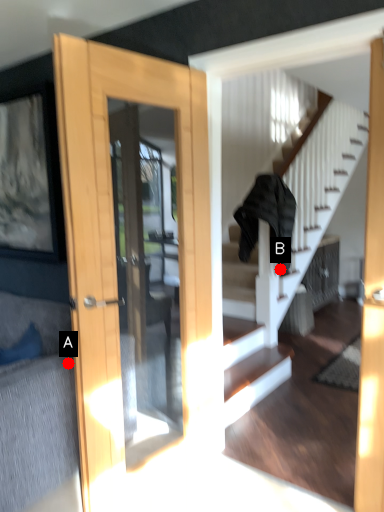
Question: Two points are circled on the image, labeled by A and B beside each circle. Which point is farther to the camera?

Choices:
 (A) A is further
 (B) B is further

Answer: (B)